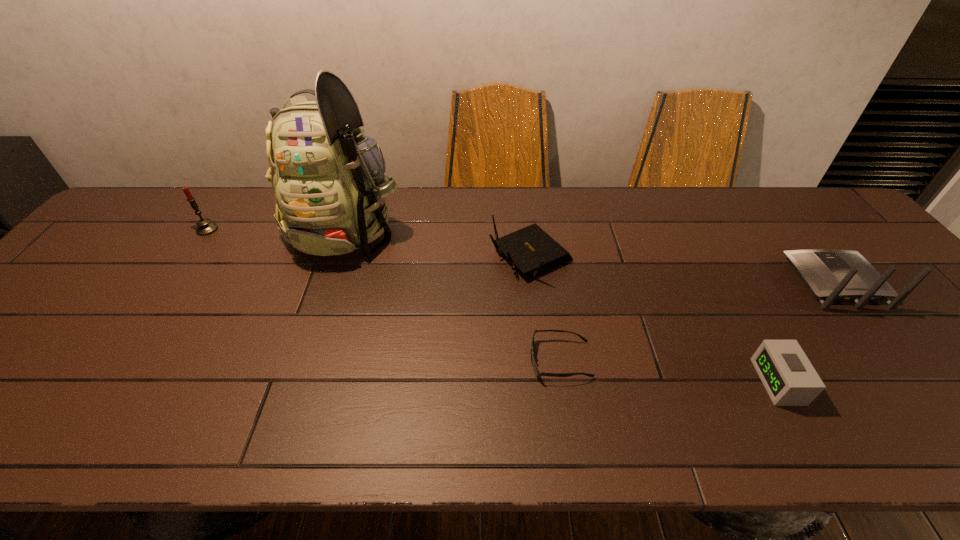
The image size is (960, 540). Find the location of `vacant region located 0.100m on the front-facing side of the sunglasses`. vacant region located 0.100m on the front-facing side of the sunglasses is located at coordinates (485, 360).

This screenshot has height=540, width=960. In order to click on vacant space located 0.110m on the front-facing side of the sunglasses in this screenshot , I will do tap(480, 360).

This screenshot has width=960, height=540. Find the location of `backpack that is positioned at the far edge`. backpack that is positioned at the far edge is located at coordinates (328, 179).

Find the location of a particular element. The image size is (960, 540). candle situated at the far edge is located at coordinates (205, 227).

Locate an element on the screen. router located at the far edge is located at coordinates (530, 249).

At what (x,y) coordinates should I click in order to perform the action: click on object located in the right edge section of the desktop. Please return your answer as a coordinate pair (x, y). Looking at the image, I should click on (831, 275).

Image resolution: width=960 pixels, height=540 pixels. In order to click on free space at the far edge in this screenshot , I will do `click(238, 192)`.

This screenshot has height=540, width=960. Identify the location of vacant space at the near edge of the desktop. (667, 408).

This screenshot has height=540, width=960. In order to click on vacant space at the left edge in this screenshot , I will do `click(19, 342)`.

I want to click on vacant area at the right edge of the desktop, so click(x=948, y=394).